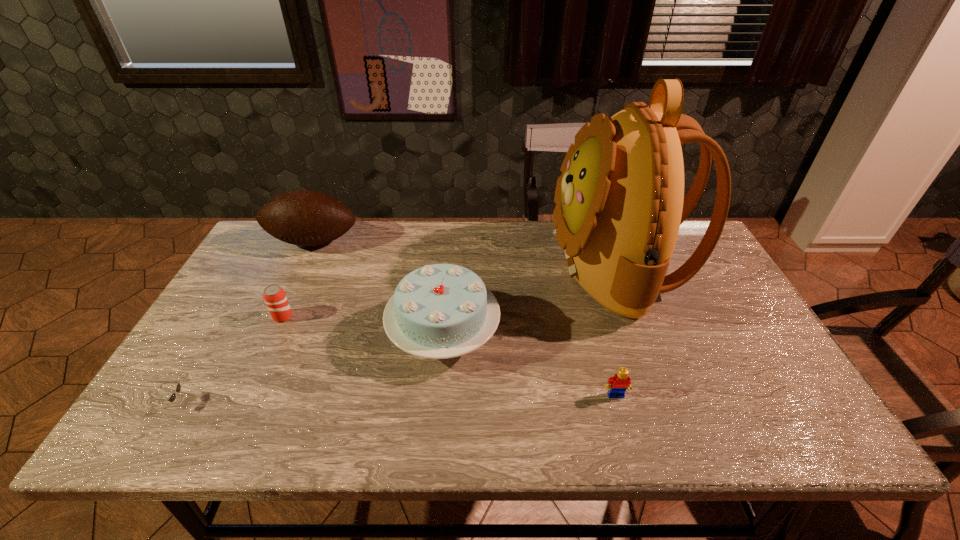
Locate an element on the screen. This screenshot has height=540, width=960. vacant space located on the right of the birthday cake is located at coordinates (538, 333).

Locate an element on the screen. The image size is (960, 540). vacant region located 0.050m on the back of the beer can is located at coordinates (292, 297).

Where is `free location located 0.100m on the front-facing side of the Lego`? free location located 0.100m on the front-facing side of the Lego is located at coordinates (628, 441).

At what (x,y) coordinates should I click in order to perform the action: click on vacant space located 0.320m in front of the lenses of the sunglasses. Please return your answer as a coordinate pair (x, y). The height and width of the screenshot is (540, 960). Looking at the image, I should click on (328, 403).

Locate an element on the screen. backpack located at the far edge is located at coordinates (620, 202).

Locate an element on the screen. football present at the far edge is located at coordinates (306, 218).

This screenshot has width=960, height=540. In order to click on object at the near edge in this screenshot , I will do tap(178, 388).

Image resolution: width=960 pixels, height=540 pixels. I want to click on football that is at the left edge, so click(306, 218).

Identify the location of sunglasses positioned at the left edge. (178, 388).

This screenshot has height=540, width=960. I want to click on object located at the right edge, so pyautogui.click(x=620, y=202).